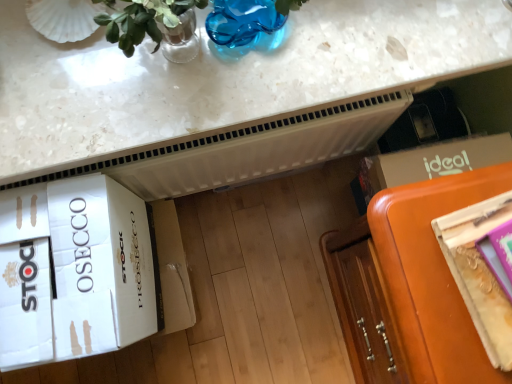
This screenshot has width=512, height=384. Identify the location of vacant area located to the right-hand side of blue glass vase at upper center. (339, 41).